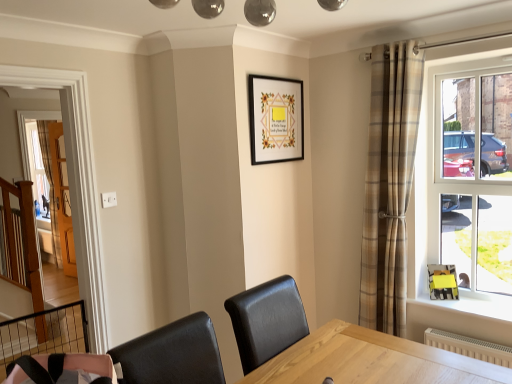
Question: Is plaid fabric curtain at right facing away from clear glass window at right?

Choices:
 (A) no
 (B) yes

Answer: (A)

Question: Is plaid fabric curtain at right smaller than clear glass window at right?

Choices:
 (A) yes
 (B) no

Answer: (B)

Question: From a real-world perspective, is plaid fabric curtain at right over clear glass window at right?

Choices:
 (A) no
 (B) yes

Answer: (A)

Question: Is the depth of plaid fabric curtain at right less than that of clear glass window at right?

Choices:
 (A) yes
 (B) no

Answer: (B)

Question: Is plaid fabric curtain at right surrounding clear glass window at right?

Choices:
 (A) yes
 (B) no

Answer: (B)

Question: Are plaid fabric curtain at right and clear glass window at right located far from each other?

Choices:
 (A) no
 (B) yes

Answer: (A)

Question: Can you confirm if black metal balustrade at lower left is bigger than clear glass window at right?

Choices:
 (A) yes
 (B) no

Answer: (B)

Question: Can you confirm if black metal balustrade at lower left is taller than clear glass window at right?

Choices:
 (A) no
 (B) yes

Answer: (A)

Question: Does black metal balustrade at lower left have a lesser width compared to clear glass window at right?

Choices:
 (A) yes
 (B) no

Answer: (A)

Question: Is black metal balustrade at lower left positioned behind clear glass window at right?

Choices:
 (A) yes
 (B) no

Answer: (B)

Question: Is black metal balustrade at lower left oriented away from clear glass window at right?

Choices:
 (A) yes
 (B) no

Answer: (B)

Question: Is black metal balustrade at lower left wider than clear glass window at right?

Choices:
 (A) yes
 (B) no

Answer: (B)

Question: Does clear glass window at right have a lesser height compared to white textured radiator at lower right?

Choices:
 (A) yes
 (B) no

Answer: (B)